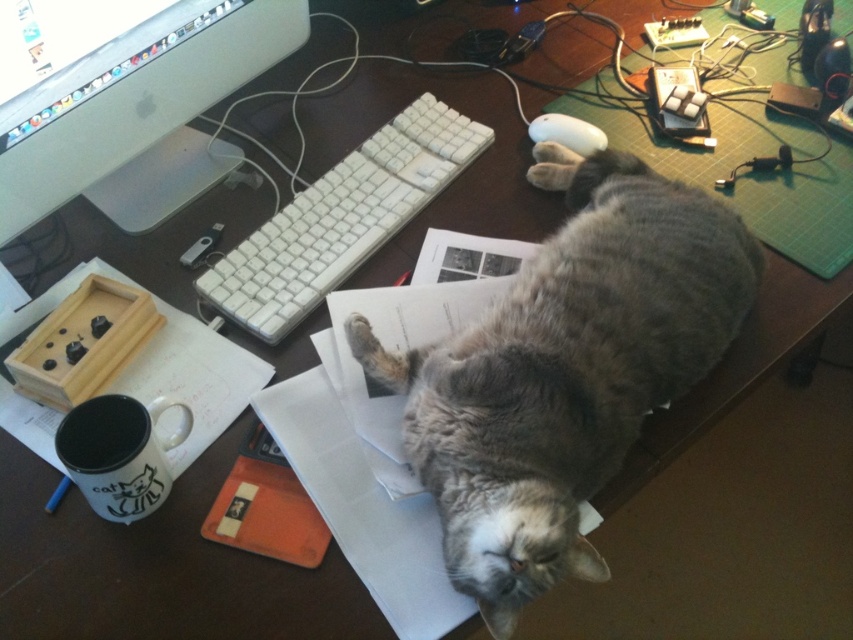
You are organizing items on a desk and need to place the white ceramic mug at lower left and the white matte mouse at upper right. Considering their sizes, which item requires more space to store?

The white ceramic mug at lower left requires more space to store because it is bigger than the white matte mouse at upper right.

In the scene shown: You are trying to reach the point closer to you on the desk. Which point should you aim for, point [732,225] or point [178,442]?

Point [732,225] is further to the viewer than point [178,442], so you should aim for point [732,225] since it is closer to you.

You are organizing the desk and want to place a new item between the sleek silver monitor at upper left and the white ceramic mug at lower left. Based on their positions, where should you place the item to ensure it is centered between them?

The sleek silver monitor at upper left is to the left of the white ceramic mug at lower left, so placing the new item halfway between their positions along the horizontal axis would center it between them.